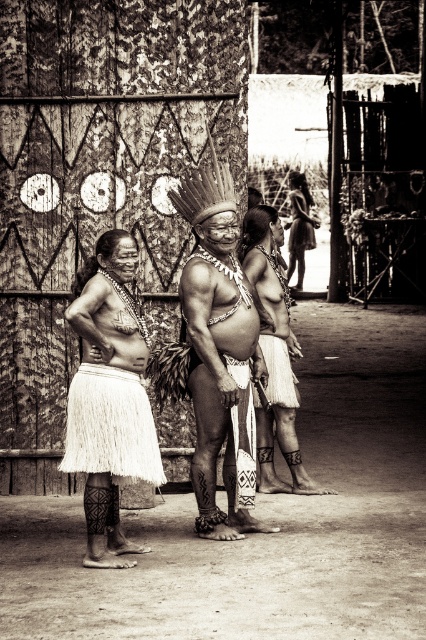
Question: Among these objects, which one is farthest from the camera?

Choices:
 (A) smooth skin man at center
 (B) white fringed skirt at left

Answer: (A)

Question: Does smooth skin man at center appear on the right side of white fringed skirt at left?

Choices:
 (A) yes
 (B) no

Answer: (A)

Question: Which point is closer to the camera?

Choices:
 (A) (109, 547)
 (B) (239, 355)

Answer: (A)

Question: Can you confirm if smooth skin man at center is bigger than white fringed skirt at left?

Choices:
 (A) no
 (B) yes

Answer: (B)

Question: Among these objects, which one is farthest from the camera?

Choices:
 (A) smooth skin man at center
 (B) white fringed skirt at left

Answer: (A)

Question: Is smooth skin man at center further to camera compared to white fringed skirt at left?

Choices:
 (A) yes
 (B) no

Answer: (A)